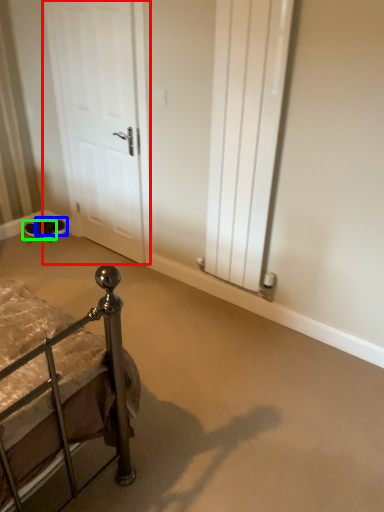
Question: Considering the real-world distances, which object is closest to door (highlighted by a red box)? footwear (highlighted by a blue box) or footwear (highlighted by a green box).

Choices:
 (A) footwear
 (B) footwear

Answer: (A)